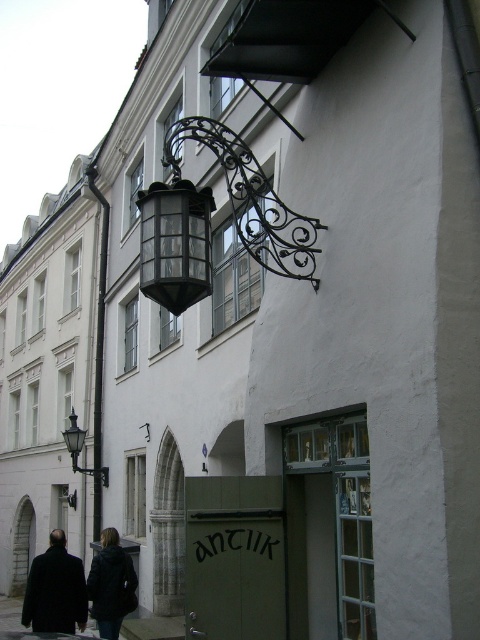
You are a delivery person trying to hang a package on the wall. The package is 1.2 meters tall. Can you hang it on the wall where the matte black lantern at upper center is located without it overlapping the dark wool coat at lower left?

The matte black lantern at upper center has a lesser height compared to the dark wool coat at lower left. Since the package is 1.2 meters tall, it might overlap the coat if placed near the lower area. However, hanging it at the upper center where the lantern is located, which is taller than the coat, should allow sufficient vertical space to avoid overlap.

You are a delivery person standing in front of the building and see the matte black lantern at upper center and the dark gray jacket at lower left. Which object is located to the right of the other?

The matte black lantern at upper center is positioned on the right side of dark gray jacket at lower left, so the lantern is to the right of the jacket.

You are an architect designing a new building and want to ensure that the matte black lantern at upper center and the dark wool coat at lower left are visible from the street. Given their sizes, which object might need to be placed higher to ensure visibility?

The matte black lantern at upper center is thinner than the dark wool coat at lower left, so the lantern might need to be placed higher to ensure visibility since it is narrower and could be obscured by the wider coat if placed lower.